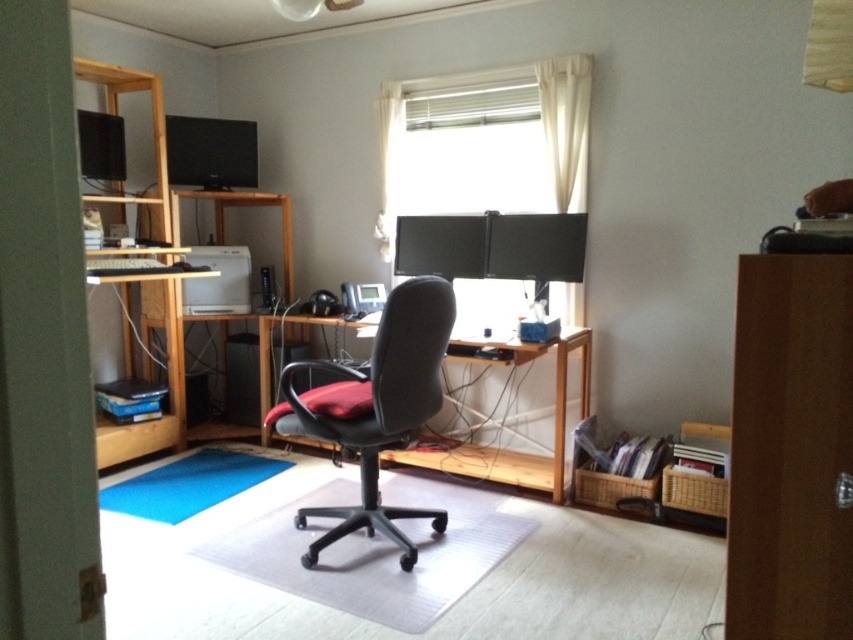
You are sitting in the matte black swivel chair at center and want to reach the wooden bookshelf at left to grab a book. How would you physically move to get there?

Since the matte black swivel chair at center is closer to you than the wooden bookshelf at left, you would need to move forward towards the wooden bookshelf at left to reach it.

You are a delivery person who needs to place a package on the floor between the matte black swivel chair at center and the camera. The package is 1 foot in length. Is there enough space between them to place the package without moving either object?

The distance between the matte black swivel chair at center and the camera is 8.28 feet. Since the package is only 1 foot long, there is sufficient space to place it between them without needing to move either object.